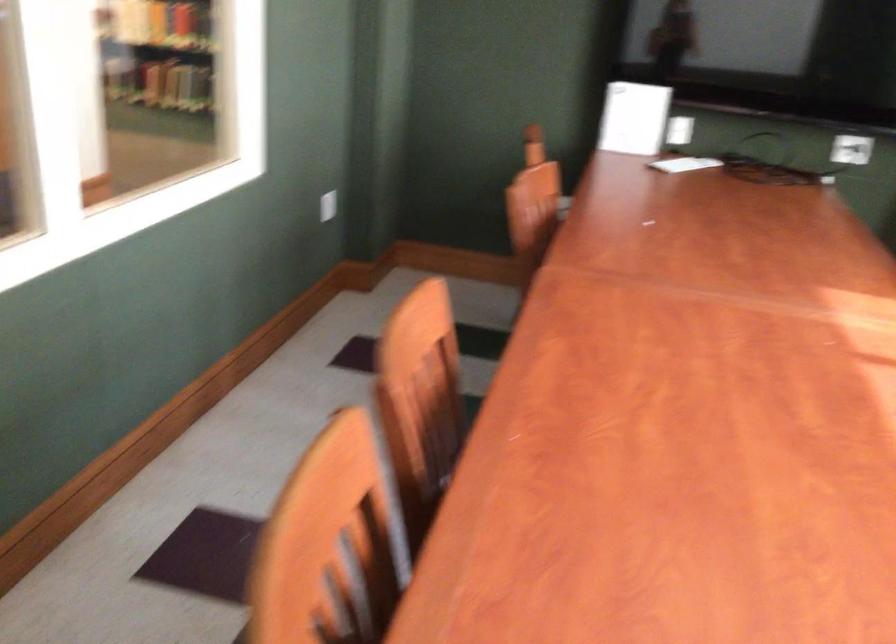
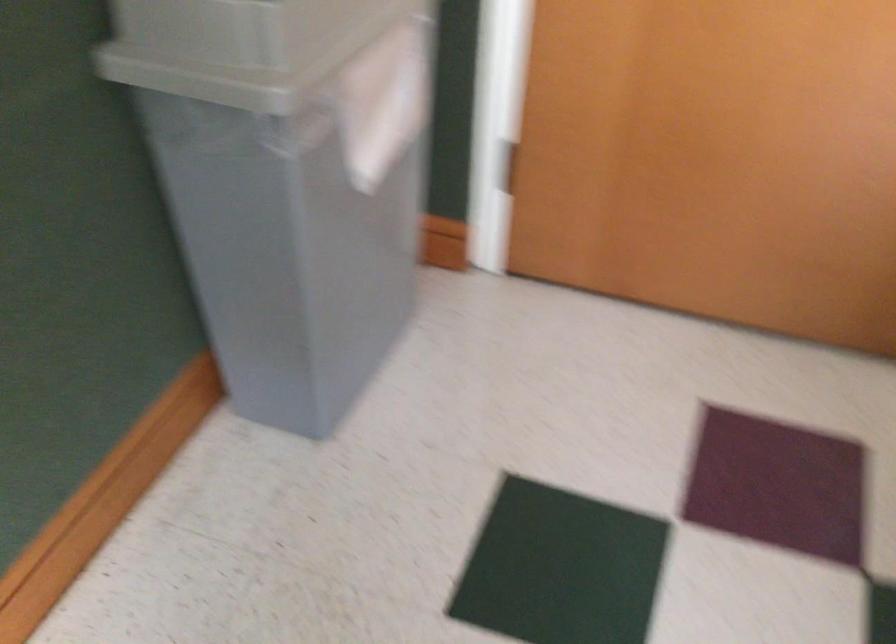
How did the camera likely rotate?

The rotation direction of the camera is left-down.